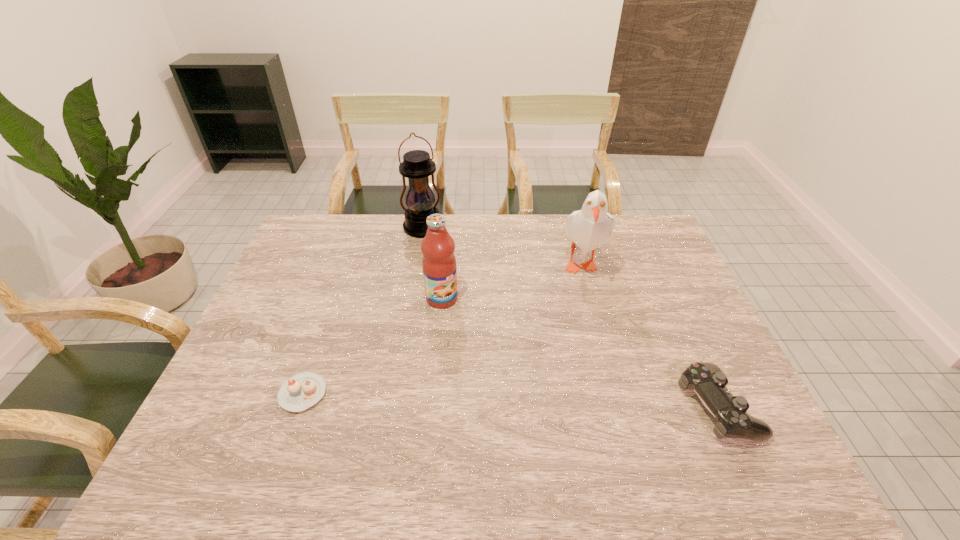
Find the location of a particular element. This screenshot has height=540, width=960. free space between the shortest object and the rightmost object is located at coordinates (510, 400).

Where is `free area in between the fruit juice and the control`? The image size is (960, 540). free area in between the fruit juice and the control is located at coordinates (580, 353).

Choose which object is the nearest neighbor to the gull. Please provide its 2D coordinates. Your answer should be formatted as a tuple, i.e. [(x, y)], where the tuple contains the x and y coordinates of a point satisfying the conditions above.

[(708, 381)]

Identify which object is located as the fourth nearest to the lantern. Please provide its 2D coordinates. Your answer should be formatted as a tuple, i.e. [(x, y)], where the tuple contains the x and y coordinates of a point satisfying the conditions above.

[(708, 381)]

Find the location of a particular element. This screenshot has width=960, height=540. vacant space that satisfies the following two spatial constraints: 1. on the front side of the fourth tallest object; 2. on the left side of the fourth object from left to right is located at coordinates (617, 407).

Image resolution: width=960 pixels, height=540 pixels. Identify the location of vacant point that satisfies the following two spatial constraints: 1. on the front side of the shortest object; 2. on the left side of the fourth tallest object. (299, 407).

You are a GUI agent. You are given a task and a screenshot of the screen. Output one action in this format:
    pyautogui.click(x=<x>, y=<y>)
    Task: Click on the vacant region that satisfies the following two spatial constraints: 1. on the front side of the fruit juice; 2. on the left side of the fourth tallest object
    
    Given the screenshot: What is the action you would take?
    pyautogui.click(x=432, y=407)